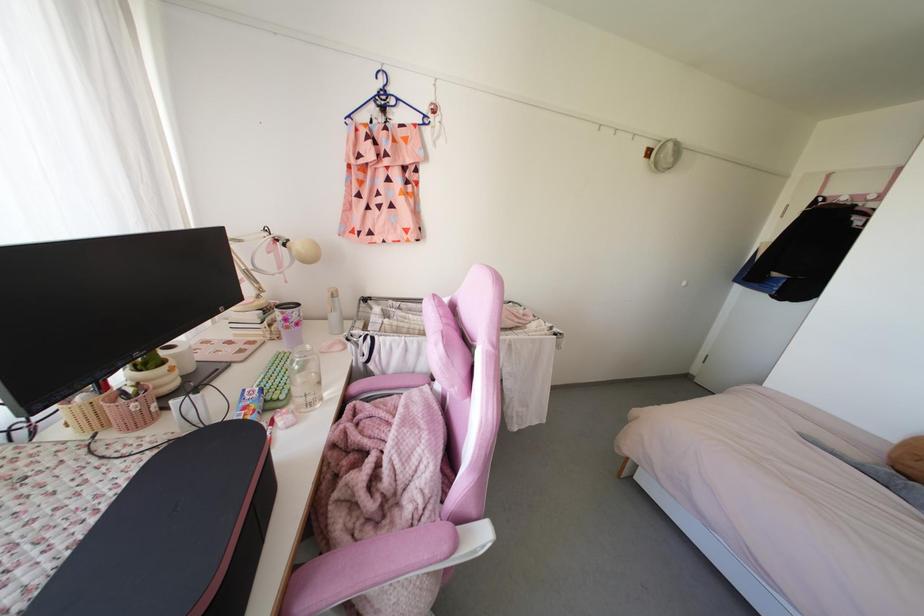
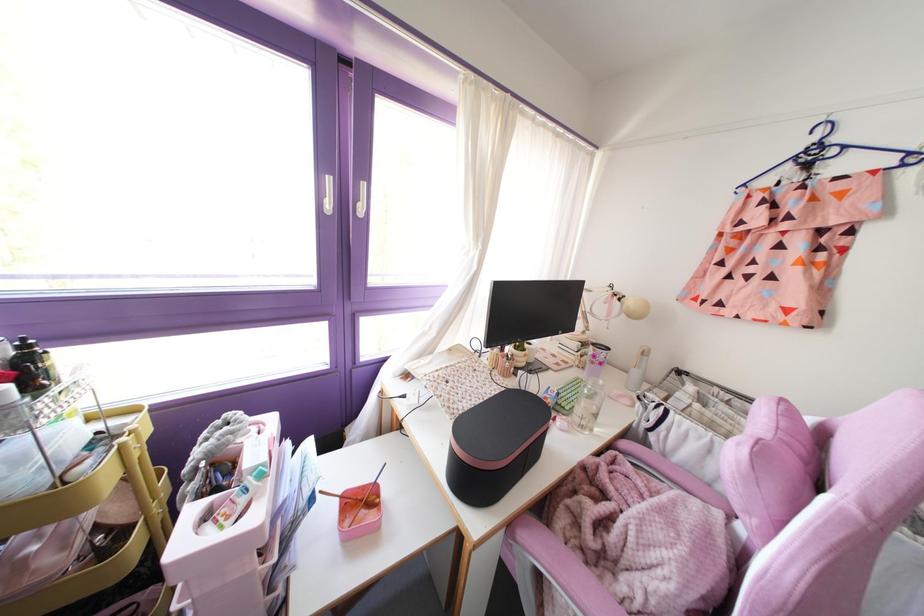
Where in the second image is the point corresponding to (x=388, y=493) from the first image?

(610, 553)